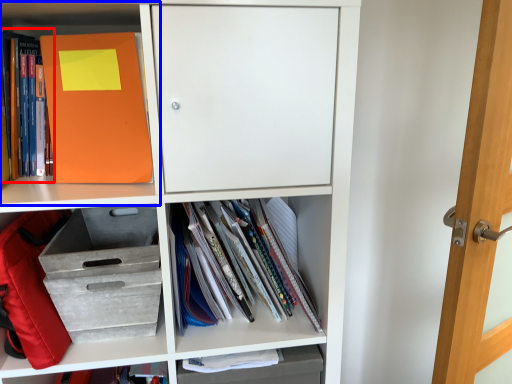
Question: Which of the following is the farthest to the observer, book (highlighted by a red box) or shelf (highlighted by a blue box)?

Choices:
 (A) book
 (B) shelf

Answer: (A)